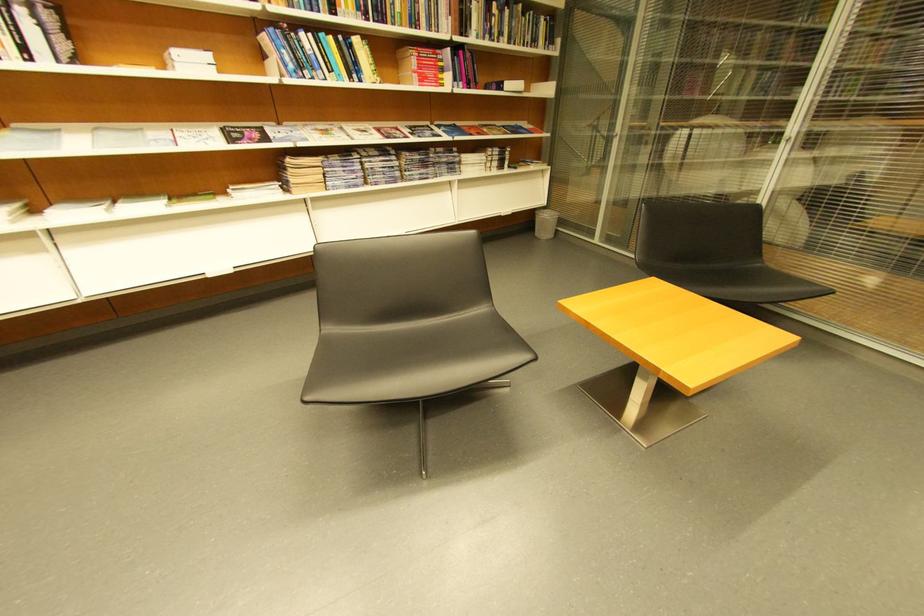
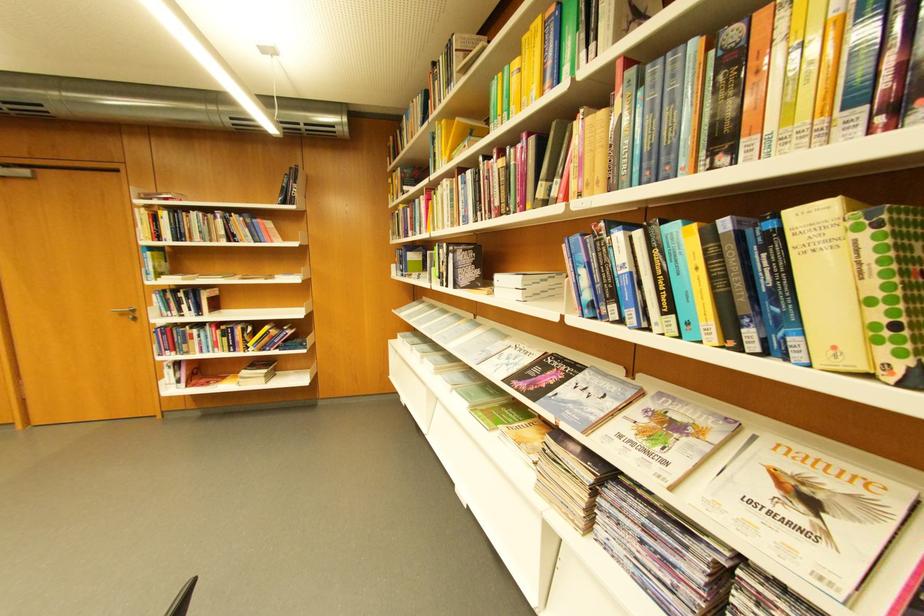
Locate, in the second image, the point that corresponds to (x=372, y=42) in the first image.

(861, 209)